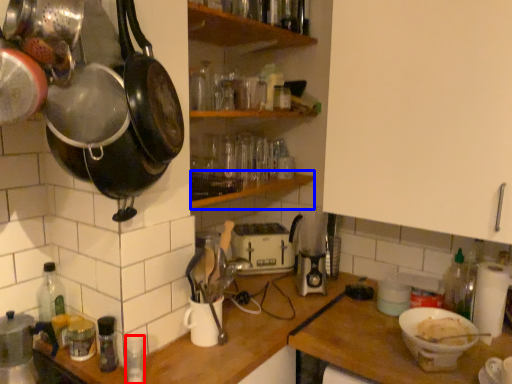
Question: Which object is further to the camera taking this photo, bottle (highlighted by a red box) or shelf (highlighted by a blue box)?

Choices:
 (A) bottle
 (B) shelf

Answer: (B)